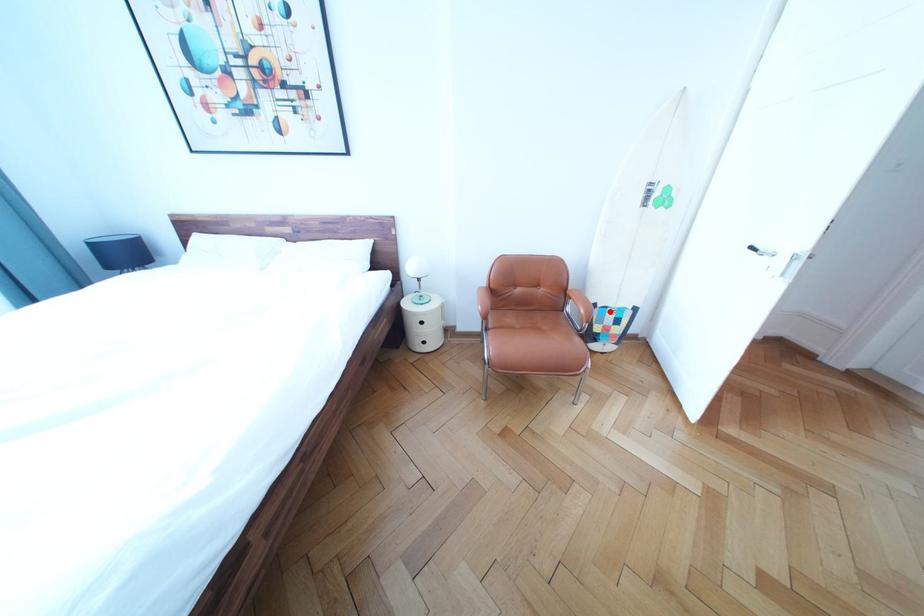
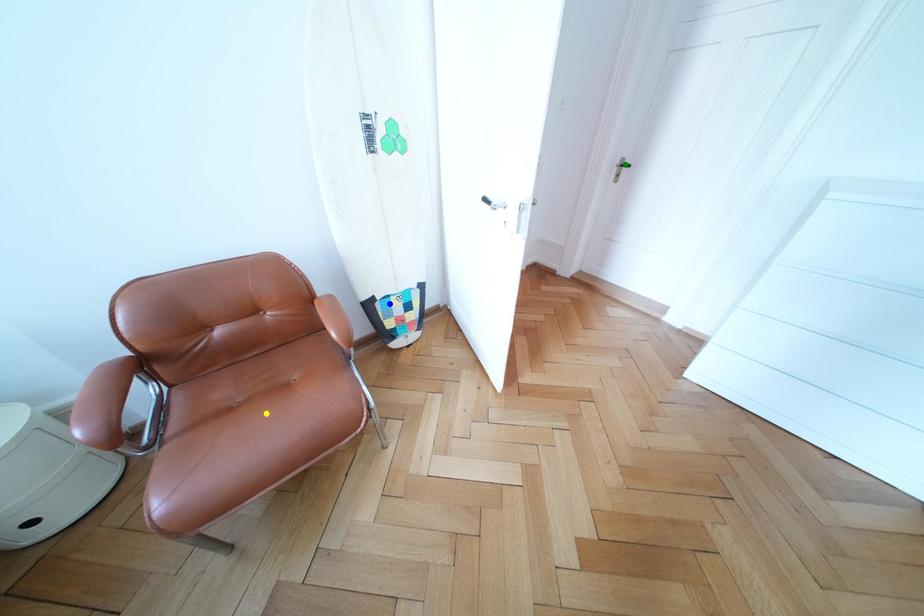
Question: I am providing you with two images of the same scene from different viewpoints. A red point is marked on the first image. You are given multiple points on the second image. Which mark in image 2 goes with the point in image 1?

Choices:
 (A) green point
 (B) blue point
 (C) yellow point

Answer: (B)